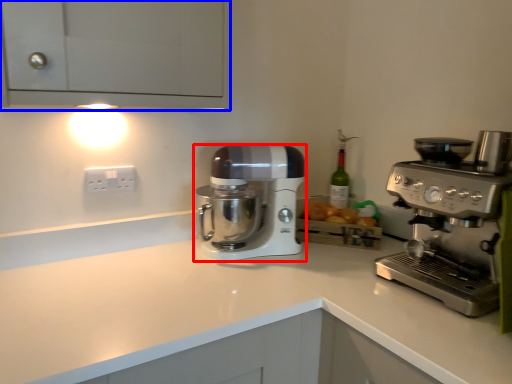
Question: Which object is further to the camera taking this photo, mixer (highlighted by a red box) or cabinetry (highlighted by a blue box)?

Choices:
 (A) mixer
 (B) cabinetry

Answer: (A)